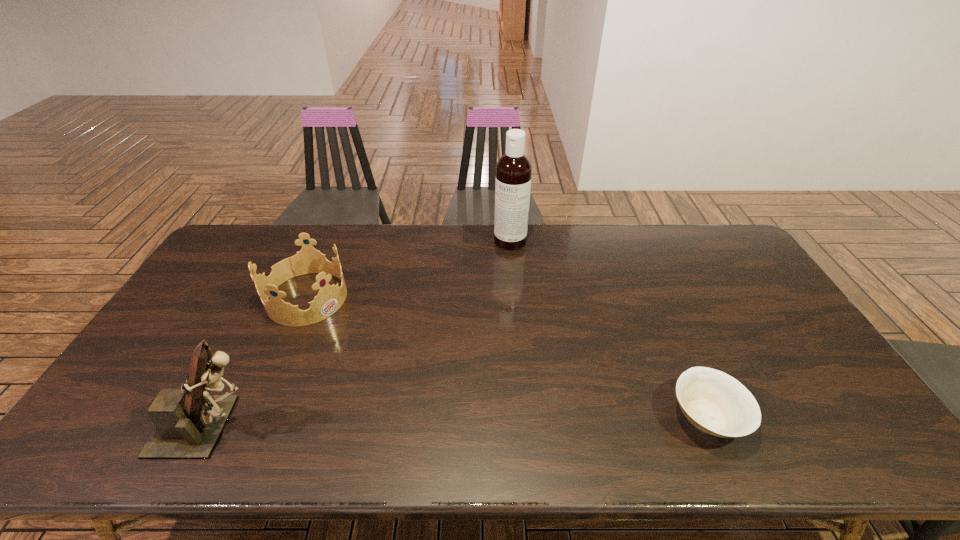
Where is `figurine`? figurine is located at coordinates (189, 421).

Find the location of `bowl`. bowl is located at coordinates (714, 402).

What are the coordinates of `the shortest object` in the screenshot? It's located at (714, 402).

Where is `the second farthest object`? The width and height of the screenshot is (960, 540). the second farthest object is located at coordinates (330, 298).

The width and height of the screenshot is (960, 540). In order to click on the third tallest object in this screenshot , I will do `click(330, 298)`.

The height and width of the screenshot is (540, 960). I want to click on the tallest object, so click(x=513, y=169).

I want to click on the farthest object, so click(513, 169).

In order to click on free space located 0.080m on the right of the bowl in this screenshot , I will do `click(779, 417)`.

You are a GUI agent. You are given a task and a screenshot of the screen. Output one action in this format:
    pyautogui.click(x=<x>, y=<y>)
    Task: Click on the vacant space located on the front-facing side of the second farthest object
    Image resolution: width=960 pixels, height=540 pixels.
    Given the screenshot: What is the action you would take?
    pyautogui.click(x=361, y=332)

The height and width of the screenshot is (540, 960). Find the location of `free space located on the front-facing side of the second farthest object`. free space located on the front-facing side of the second farthest object is located at coordinates (393, 352).